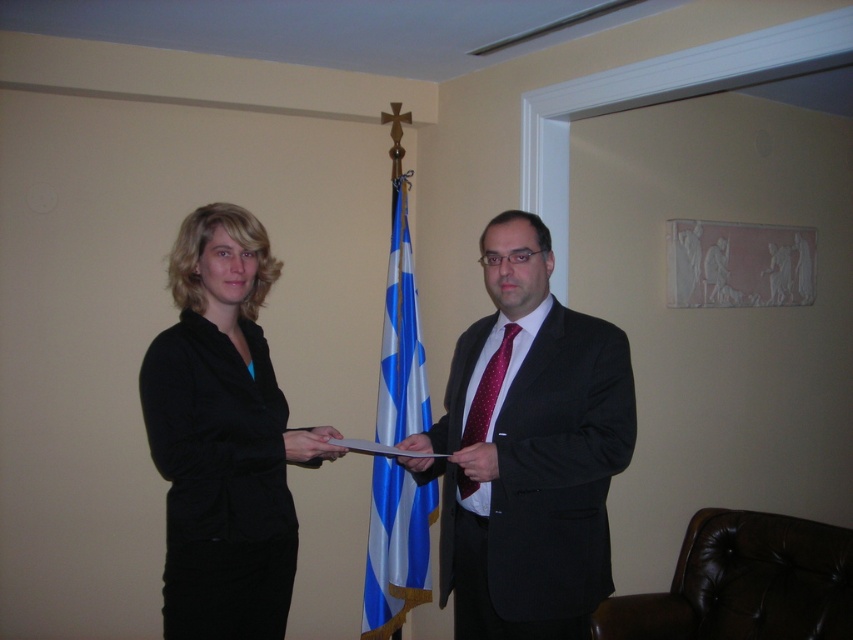
You are standing in a room and see the black matte blazer at left. If you want to locate it precisely on a coordinate system where the bottom left corner is the origin, what are its coordinates?

The coordinates of the black matte blazer at left are at point [219,436].

You are standing in the room and see the point at coordinates point (213, 564). If you want to reach it without moving your feet, can you do it?

The point (213, 564) is 6.20 feet away from viewer, so if you cannot move your feet, you cannot reach it since it is too far.